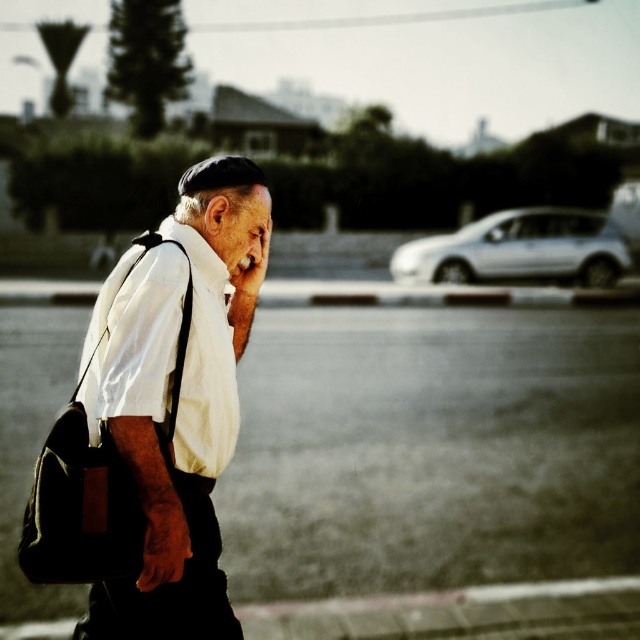
You are a delivery person trying to navigate a narrow path between two parked cars. You see the smooth asphalt road at center and the black leather messenger bag at left. Which object is wider?

The smooth asphalt road at center is wider than the black leather messenger bag at left according to the description.

You are a pedestrian trying to cross the smooth asphalt road at center. There is a man wearing a white cotton shirt at left. Based on the scene, is the man in front of or behind the road relative to your position?

The white cotton shirt at left is behind the smooth asphalt road at center, so the man is behind the road relative to your position.

You are a delivery person planning to drive a 2.5 meter wide truck through the smooth asphalt road at center. Considering the size of the road compared to the white cotton shirt at left, can the truck fit through the road?

The smooth asphalt road at center has a larger size compared to the white cotton shirt at left. However, the size comparison between the road and the shirt does not provide specific measurements about the road width. Without knowing the exact width of the road, it is impossible to determine if the truck can fit through the road.